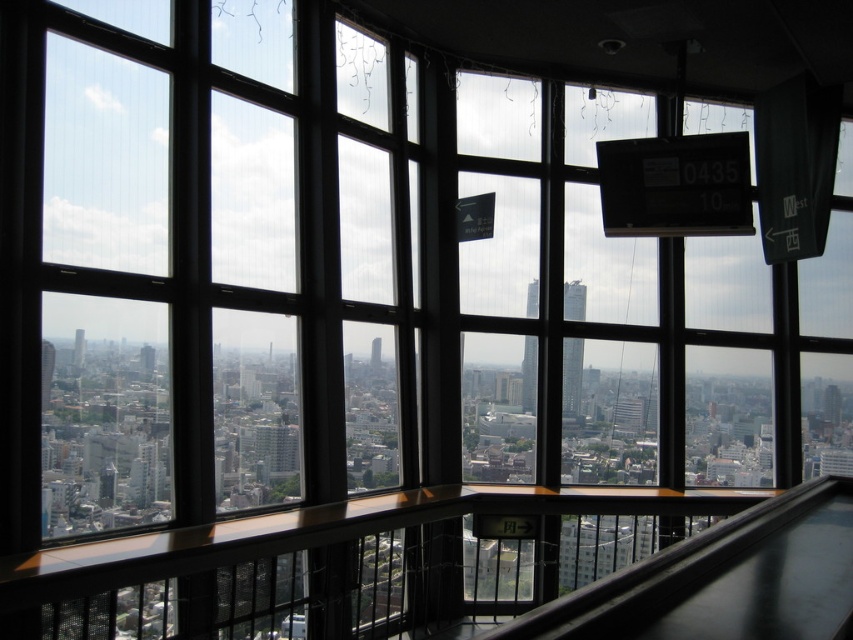
Can you confirm if glassy reflective skyscraper at center is positioned below matte glass tower at left?

Actually, glassy reflective skyscraper at center is above matte glass tower at left.

Can you confirm if glassy reflective skyscraper at center is wider than matte glass tower at left?

Yes, glassy reflective skyscraper at center is wider than matte glass tower at left.

Between point (534, 289) and point (44, 346), which one is positioned in front?

Point (44, 346) is more forward.

Locate an element on the screen. glassy reflective skyscraper at center is located at coordinates (529, 374).

What do you see at coordinates (572, 376) in the screenshot? I see `smooth glass tower at center` at bounding box center [572, 376].

Is smooth glass tower at center further to the viewer compared to matte glass tower at left?

Yes, smooth glass tower at center is behind matte glass tower at left.

Image resolution: width=853 pixels, height=640 pixels. I want to click on smooth glass tower at center, so click(x=572, y=376).

This screenshot has height=640, width=853. What are the coordinates of `smooth glass tower at center` in the screenshot? It's located at (572, 376).

How much distance is there between smooth glass tower at center and matte glass tower at center?

smooth glass tower at center and matte glass tower at center are 375.91 meters apart from each other.

Which of these two, smooth glass tower at center or matte glass tower at center, stands taller?

Standing taller between the two is smooth glass tower at center.

Locate an element on the screen. Image resolution: width=853 pixels, height=640 pixels. smooth glass tower at center is located at coordinates [572, 376].